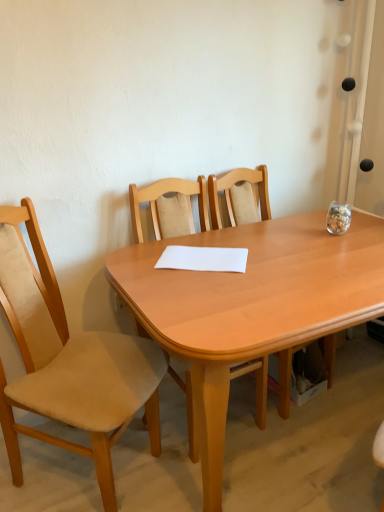
Question: Is light wood table at center inside beige fabric chair at left, the first chair when ordered from left to right?

Choices:
 (A) yes
 (B) no

Answer: (B)

Question: Could you tell me if beige fabric chair at left, the first chair when ordered from left to right, is facing light wood table at center?

Choices:
 (A) yes
 (B) no

Answer: (A)

Question: Is beige fabric chair at left, the first chair when ordered from left to right, thinner than light wood table at center?

Choices:
 (A) yes
 (B) no

Answer: (A)

Question: From a real-world perspective, does beige fabric chair at left, the first chair when ordered from left to right, sit lower than light wood table at center?

Choices:
 (A) no
 (B) yes

Answer: (A)

Question: Considering the relative sizes of beige fabric chair at left, placed as the third chair when sorted from right to left, and light wood table at center in the image provided, is beige fabric chair at left, placed as the third chair when sorted from right to left, taller than light wood table at center?

Choices:
 (A) no
 (B) yes

Answer: (B)

Question: Is beige fabric chair at left, the first chair when ordered from left to right, located outside light wood table at center?

Choices:
 (A) no
 (B) yes

Answer: (B)

Question: Is light wood table at center not inside beige fabric chair at left, the first chair when ordered from left to right?

Choices:
 (A) no
 (B) yes

Answer: (B)

Question: Does light wood table at center have a larger size compared to beige fabric chair at left, the first chair when ordered from left to right?

Choices:
 (A) no
 (B) yes

Answer: (B)

Question: Does light wood table at center appear on the left side of beige fabric chair at left, the first chair when ordered from left to right?

Choices:
 (A) yes
 (B) no

Answer: (B)

Question: Does light wood table at center have a smaller size compared to beige fabric chair at left, the first chair when ordered from left to right?

Choices:
 (A) no
 (B) yes

Answer: (A)

Question: From a real-world perspective, is light wood table at center on beige fabric chair at left, placed as the third chair when sorted from right to left?

Choices:
 (A) no
 (B) yes

Answer: (A)

Question: Is light wood table at center thinner than beige fabric chair at left, the first chair when ordered from left to right?

Choices:
 (A) yes
 (B) no

Answer: (B)

Question: Is there a large distance between white paper at center and light wood chair at center, which is the second chair from right to left?

Choices:
 (A) yes
 (B) no

Answer: (B)